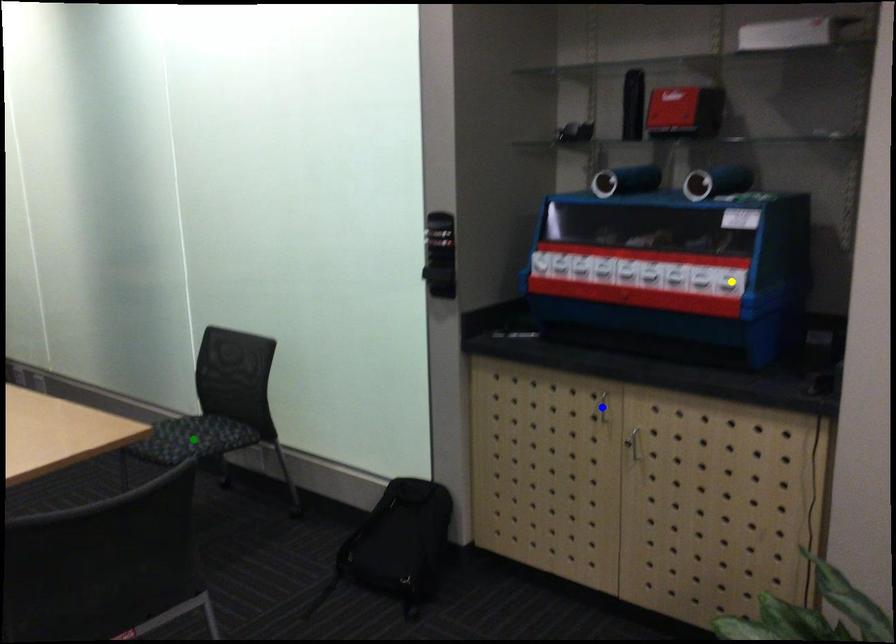
Order these from nearest to farthest:
1. green point
2. yellow point
3. blue point

yellow point → blue point → green point